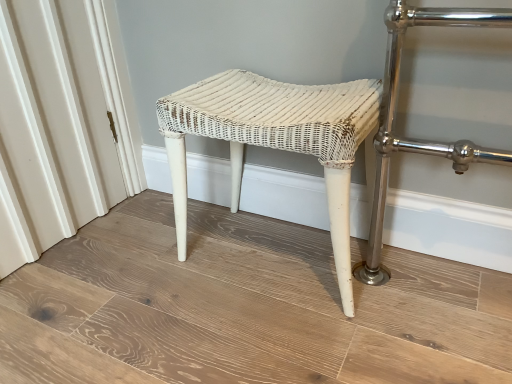
Locate an element on the screen. free space in front of white wicker stool at center is located at coordinates (286, 335).